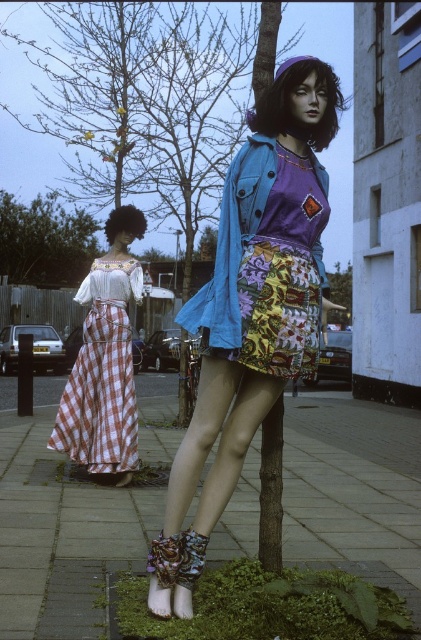
You are a drone operator trying to capture a photo of the matte blue denim jacket at center and the green leafy tree at upper left in the same frame. The drone has a maximum zoom range of 20 meters. Can you fit both objects in the frame without moving the drone?

The distance between the matte blue denim jacket at center and the green leafy tree at upper left is 25.20 meters, which exceeds the drone camera maximum zoom range of 20 meters. Therefore, it is not possible to capture both objects in the same frame without moving the drone.

You are a fashion designer observing the two mannequins. You need to determine the spatial relationship between the checkered fabric dress at left and the denim jacket at center. Which one is positioned lower in the image?

The checkered fabric dress at left is positioned below denim jacket at center, so it is lower in the image.